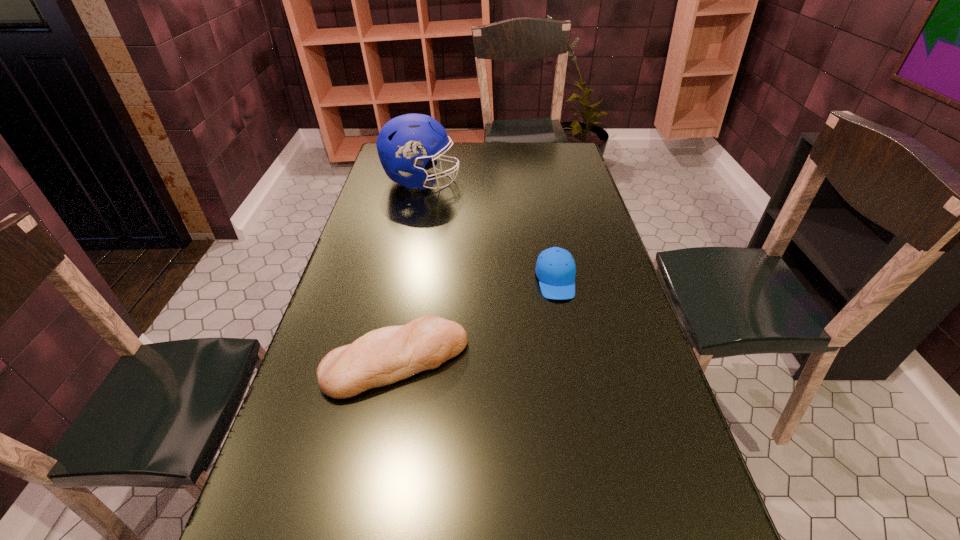
Locate an element on the screen. the farthest object is located at coordinates (403, 144).

The height and width of the screenshot is (540, 960). I want to click on football helmet, so click(x=403, y=144).

Locate an element on the screen. The image size is (960, 540). the rightmost object is located at coordinates (555, 269).

Find the location of a particular element. the second nearest object is located at coordinates (555, 269).

Identify the location of the nearest object. The width and height of the screenshot is (960, 540). (381, 357).

Identify the location of free region located 0.090m on the front-facing side of the football helmet. The width and height of the screenshot is (960, 540). (484, 181).

Find the location of a particular element. The height and width of the screenshot is (540, 960). vacant point located on the front-facing side of the second nearest object is located at coordinates click(587, 436).

Find the location of a particular element. vacant position located 0.130m on the front of the nearest object is located at coordinates (378, 460).

Locate an element on the screen. object located in the far edge section of the desktop is located at coordinates (403, 144).

At what (x,y) coordinates should I click in order to perform the action: click on football helmet that is at the left edge. Please return your answer as a coordinate pair (x, y). This screenshot has height=540, width=960. Looking at the image, I should click on pos(403,144).